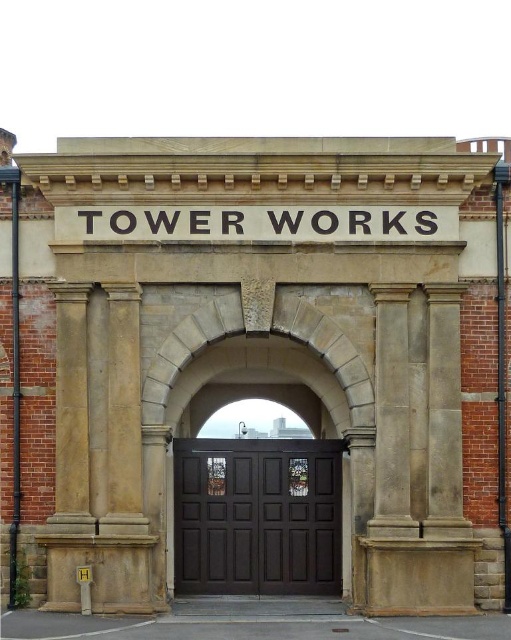
You are standing at the entrance of Tower Works and want to locate the dark wood door at center. Based on the coordinates provided, where should you look relative to the central archway?

The dark wood door at center is located at the coordinates point (258, 516), which places it slightly to the right and at the midpoint vertically relative to the central archway.

You are an architect inspecting the entrance of Tower Works. You need to determine if the dark wood door at center can be replaced with a wider door without altering the existing black stone sign at center. Based on the spatial relationship between them, what is your assessment?

The dark wood door at center has a lesser width compared to the black stone sign at center. Since the door is narrower than the sign, it can potentially be replaced with a wider door as long as the new door does not exceed the width of the black stone sign at center to maintain structural integrity.